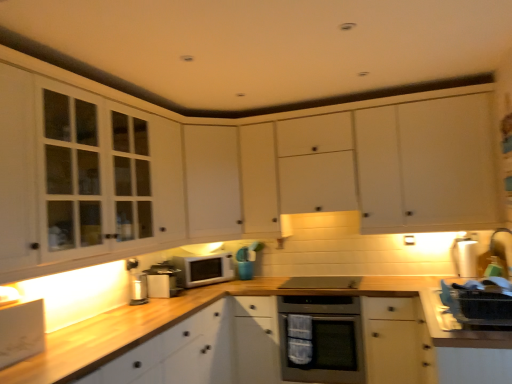
Question: Considering the positions of satin black stove at center, the second appliance when ordered from right to left, and white matte cabinet at center, which ranks as the fourth cabinetry in bottom-to-top order, in the image, is satin black stove at center, the second appliance when ordered from right to left, wider or thinner than white matte cabinet at center, which ranks as the fourth cabinetry in bottom-to-top order,?

Choices:
 (A) thin
 (B) wide

Answer: (A)

Question: Do you think satin black stove at center, the 3th appliance from the left, is within white matte cabinet at center, marked as the second cabinetry in a top-to-bottom arrangement, or outside of it?

Choices:
 (A) inside
 (B) outside

Answer: (B)

Question: Based on their relative distances, which object is nearer to the wooden at center?

Choices:
 (A) white matte cabinet at center, which ranks as the fourth cabinetry in bottom-to-top order
 (B) satin silver oven at center
 (C) white matte cabinet at center, arranged as the 2th cabinetry when ordered from the bottom
 (D) white glossy water filter at right, which is the 1th appliance in right-to-left order
 (E) white matte microwave at center

Answer: (E)

Question: Estimate the real-world distances between objects in this image. Which object is closer to the white wood cabinet at lower left, positioned as the first cabinetry in bottom-to-top order?

Choices:
 (A) white matte microwave at center
 (B) white matte cabinet at center, marked as the second cabinetry in a top-to-bottom arrangement
 (C) metallic silver toaster at center, which is counted as the second appliance, starting from the left
 (D) white matte cabinet at center, which ranks as the 1th cabinetry in top-to-bottom order
 (E) white matte cabinet at center, which ranks as the fourth cabinetry in top-to-bottom order

Answer: (A)